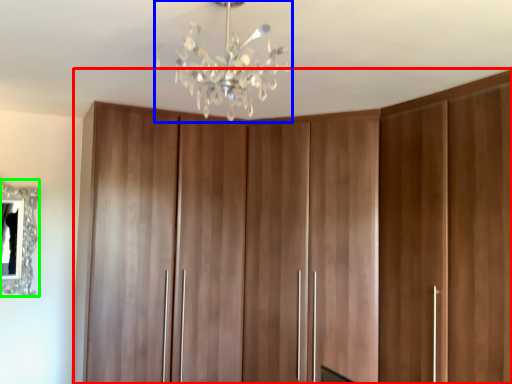
Question: Based on their relative distances, which object is farther from cupboard (highlighted by a red box)? Choose from lamp (highlighted by a blue box) and mirror (highlighted by a green box).

Choices:
 (A) lamp
 (B) mirror

Answer: (B)